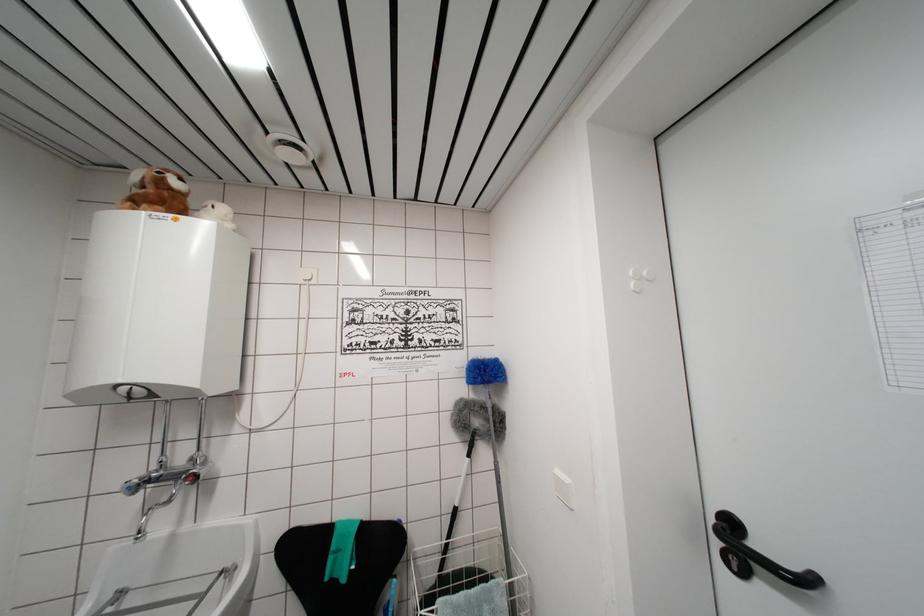
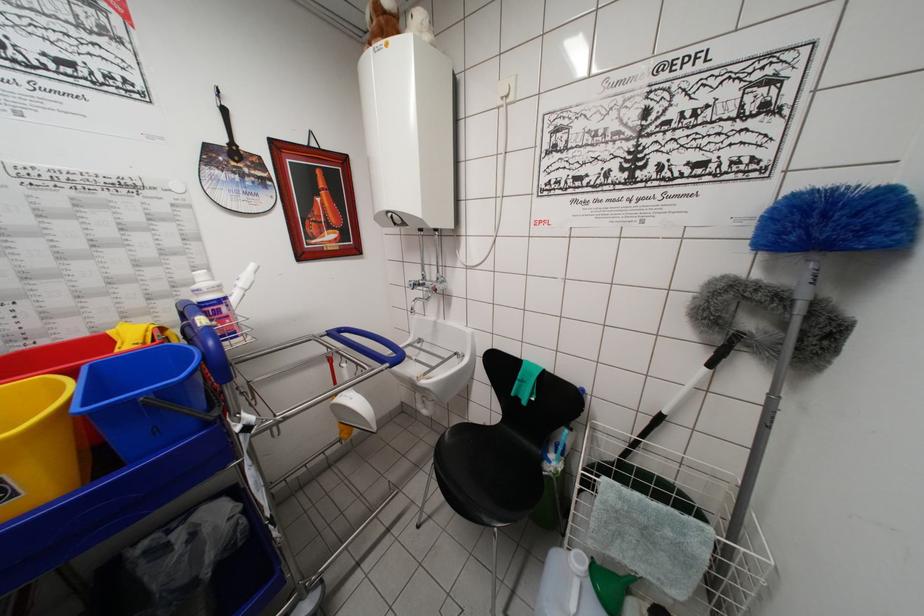
Locate, in the second image, the point that corresponds to the point at 477,548 in the first image.

(685, 469)